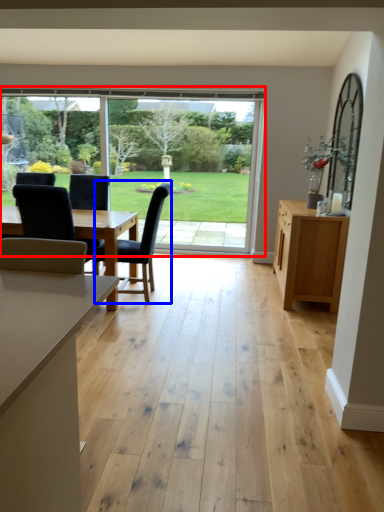
Question: Which of the following is the farthest to the observer, window (highlighted by a red box) or chair (highlighted by a blue box)?

Choices:
 (A) window
 (B) chair

Answer: (A)